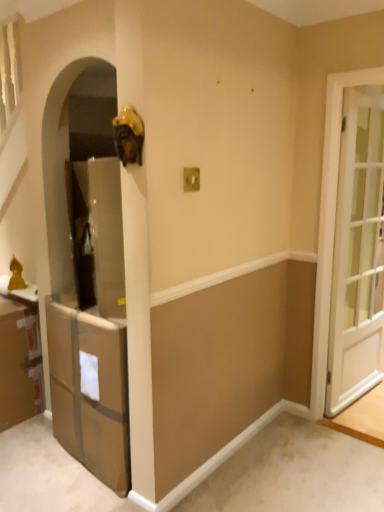
Question: From the image's perspective, is brown cardboard cabinet at lower left, positioned as the first cabinetry in left-to-right order, located beneath white glossy door at right?

Choices:
 (A) no
 (B) yes

Answer: (B)

Question: Is brown cardboard cabinet at lower left, positioned as the first cabinetry in left-to-right order, outside white glossy door at right?

Choices:
 (A) no
 (B) yes

Answer: (B)

Question: Could you tell me if brown cardboard cabinet at lower left, positioned as the first cabinetry in left-to-right order, is facing white glossy door at right?

Choices:
 (A) no
 (B) yes

Answer: (A)

Question: From the image's perspective, is brown cardboard cabinet at lower left, positioned as the first cabinetry in left-to-right order, located above white glossy door at right?

Choices:
 (A) no
 (B) yes

Answer: (A)

Question: Can you confirm if brown cardboard cabinet at lower left, positioned as the first cabinetry in left-to-right order, is thinner than white glossy door at right?

Choices:
 (A) no
 (B) yes

Answer: (A)

Question: From the image's perspective, is brown cardboard cabinet at lower left, acting as the first cabinetry starting from the right, positioned above or below white glossy door at right?

Choices:
 (A) below
 (B) above

Answer: (A)

Question: Is brown cardboard cabinet at lower left, which is counted as the second cabinetry, starting from the left, in front of or behind white glossy door at right in the image?

Choices:
 (A) front
 (B) behind

Answer: (A)

Question: Looking at their shapes, would you say brown cardboard cabinet at lower left, acting as the first cabinetry starting from the right, is wider or thinner than white glossy door at right?

Choices:
 (A) thin
 (B) wide

Answer: (B)

Question: Based on their sizes in the image, would you say brown cardboard cabinet at lower left, acting as the first cabinetry starting from the right, is bigger or smaller than white glossy door at right?

Choices:
 (A) small
 (B) big

Answer: (B)

Question: From the image's perspective, is brown cardboard cabinet at lower left, which is counted as the second cabinetry, starting from the left, positioned above or below brown cardboard cabinet at lower left, positioned as the first cabinetry in left-to-right order?

Choices:
 (A) below
 (B) above

Answer: (A)

Question: From a real-world perspective, is brown cardboard cabinet at lower left, acting as the first cabinetry starting from the right, above or below brown cardboard cabinet at lower left, positioned as the first cabinetry in left-to-right order?

Choices:
 (A) below
 (B) above

Answer: (B)

Question: Considering their positions, is brown cardboard cabinet at lower left, acting as the first cabinetry starting from the right, located in front of or behind brown cardboard cabinet at lower left, positioned as the first cabinetry in left-to-right order?

Choices:
 (A) behind
 (B) front

Answer: (B)

Question: Do you think brown cardboard cabinet at lower left, which is counted as the second cabinetry, starting from the left, is within brown cardboard cabinet at lower left, positioned as the first cabinetry in left-to-right order, or outside of it?

Choices:
 (A) inside
 (B) outside

Answer: (B)

Question: In terms of height, does brown cardboard cabinet at lower left, the 2th cabinetry from the right, look taller or shorter compared to white glossy door at right?

Choices:
 (A) tall
 (B) short

Answer: (B)

Question: Is point (16, 326) closer or farther from the camera than point (375, 356)?

Choices:
 (A) farther
 (B) closer

Answer: (B)